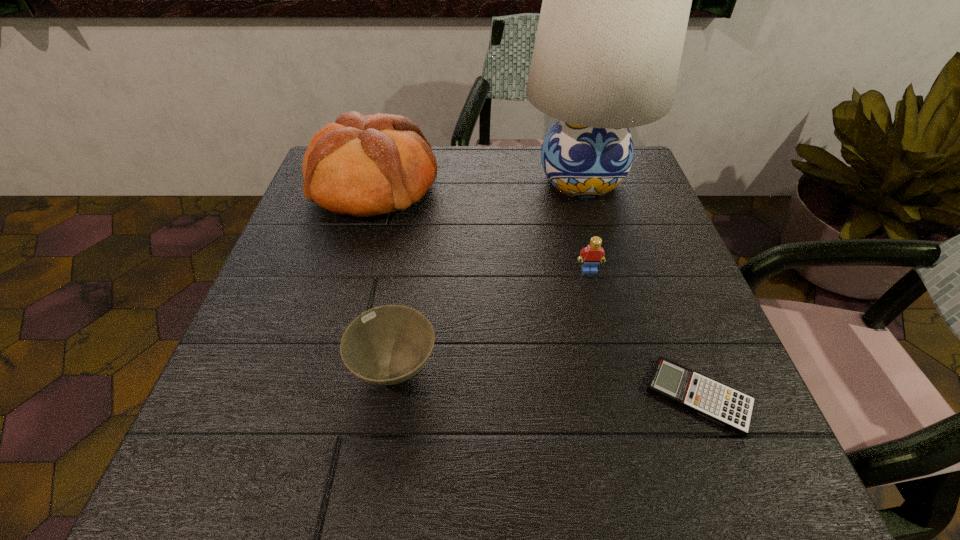
This screenshot has width=960, height=540. In order to click on empty space between the bread and the bowl in this screenshot , I will do `click(385, 277)`.

Where is `free space between the tallest object and the third farthest object`? free space between the tallest object and the third farthest object is located at coordinates (586, 225).

Image resolution: width=960 pixels, height=540 pixels. I want to click on free spot between the bowl and the shortest object, so click(546, 382).

Where is `blank region between the bowl and the third farthest object`? This screenshot has height=540, width=960. blank region between the bowl and the third farthest object is located at coordinates (492, 319).

Identify which object is the fourth nearest to the bowl. Please provide its 2D coordinates. Your answer should be formatted as a tuple, i.e. [(x, y)], where the tuple contains the x and y coordinates of a point satisfying the conditions above.

[(616, 1)]

In order to click on object that ranks as the closest to the shortest object in this screenshot , I will do `click(593, 254)`.

In order to click on free spot that satisfies the following two spatial constraints: 1. on the front-facing side of the Lego; 2. on the left side of the calculator in this screenshot , I will do `click(619, 397)`.

Find the location of `vacant region that satisfies the following two spatial constraints: 1. on the front side of the shortest object; 2. on the left side of the bowl`. vacant region that satisfies the following two spatial constraints: 1. on the front side of the shortest object; 2. on the left side of the bowl is located at coordinates (390, 397).

The height and width of the screenshot is (540, 960). Identify the location of vacant region that satisfies the following two spatial constraints: 1. on the front-facing side of the shortest object; 2. on the left side of the Lego. (619, 397).

You are a GUI agent. You are given a task and a screenshot of the screen. Output one action in this format:
    pyautogui.click(x=<x>, y=<y>)
    Task: Click on the vacant space that satisfies the following two spatial constraints: 1. on the front-facing side of the calculator; 2. on the left side of the Lego
    The image size is (960, 540).
    Given the screenshot: What is the action you would take?
    pyautogui.click(x=619, y=397)